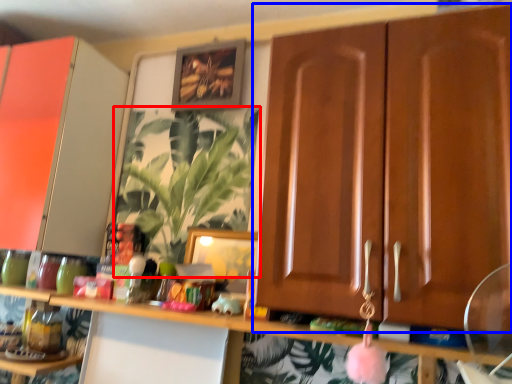
Question: Which of the following is the farthest to the observer, houseplant (highlighted by a red box) or cabinetry (highlighted by a blue box)?

Choices:
 (A) houseplant
 (B) cabinetry

Answer: (A)